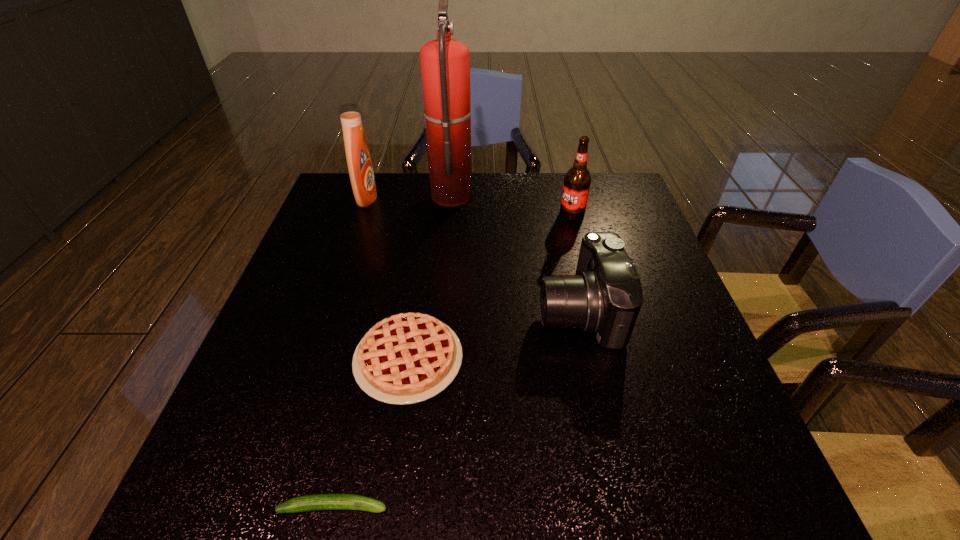
Identify the location of the tallest object. This screenshot has height=540, width=960. (445, 63).

Identify the location of the fifth shortest object. (359, 163).

Image resolution: width=960 pixels, height=540 pixels. I want to click on root beer, so click(577, 180).

Locate an element on the screen. the third shortest object is located at coordinates (605, 296).

I want to click on pie, so click(x=407, y=358).

You are a GUI agent. You are given a task and a screenshot of the screen. Output one action in this format:
    pyautogui.click(x=<x>, y=<y>)
    Task: Click on the nearest object
    The image size is (960, 540).
    Given the screenshot: What is the action you would take?
    pyautogui.click(x=319, y=501)

Where is `the shortest object`? the shortest object is located at coordinates (319, 501).

Locate an element on the screen. This screenshot has height=540, width=960. free space located 0.380m with the nozzle and gauge on the fire extinguisher is located at coordinates (596, 194).

At what (x,y) coordinates should I click in order to perform the action: click on vacant region located 0.080m on the front-facing side of the detergent. Please return your answer as a coordinate pair (x, y). Looking at the image, I should click on (403, 198).

You are a GUI agent. You are given a task and a screenshot of the screen. Output one action in this format:
    pyautogui.click(x=<x>, y=<y>)
    Task: Click on the free space located on the left of the fourth shortest object
    This screenshot has height=540, width=960.
    Given the screenshot: What is the action you would take?
    pyautogui.click(x=497, y=214)